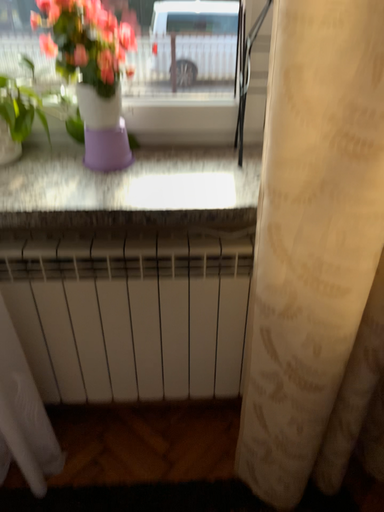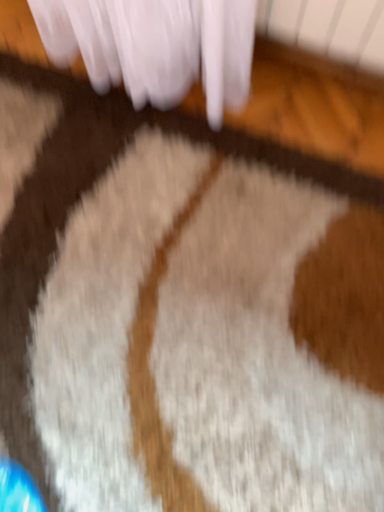
Question: Which way did the camera rotate in the video?

Choices:
 (A) rotated upward
 (B) rotated downward

Answer: (B)